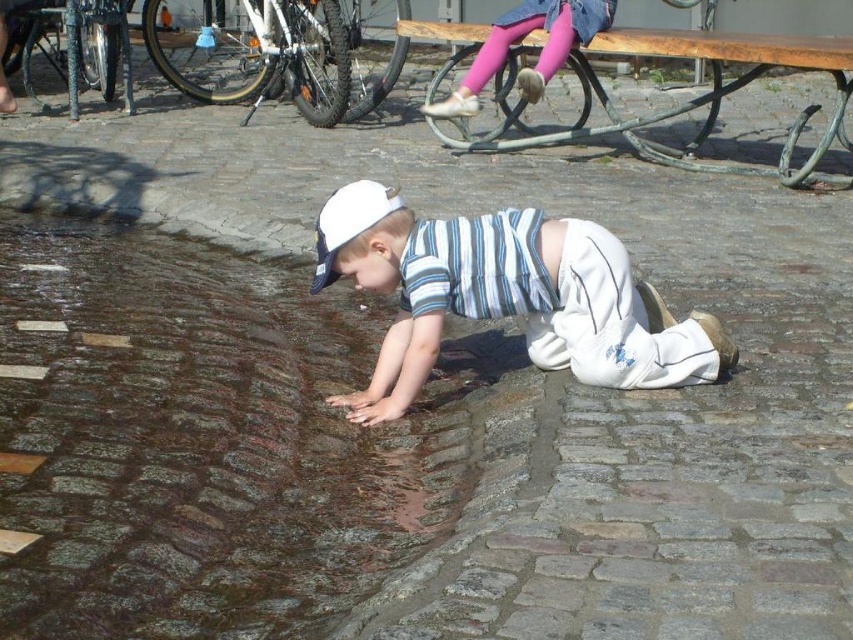
Question: Does wet cobblestone at lower center appear on the right side of pink denim leggings at upper center?

Choices:
 (A) no
 (B) yes

Answer: (A)

Question: Which point appears farthest from the camera in this image?

Choices:
 (A) (135, 387)
 (B) (604, 376)

Answer: (A)

Question: Considering the real-world distances, which object is farthest from the pink denim leggings at upper center?

Choices:
 (A) white striped shirt at center
 (B) wet cobblestone at lower center

Answer: (A)

Question: Can you confirm if wet cobblestone at lower center is bigger than pink denim leggings at upper center?

Choices:
 (A) no
 (B) yes

Answer: (B)

Question: Is wet cobblestone at lower center to the right of pink denim leggings at upper center from the viewer's perspective?

Choices:
 (A) yes
 (B) no

Answer: (B)

Question: Which is nearer to the wet cobblestone at lower center?

Choices:
 (A) white striped shirt at center
 (B) pink denim leggings at upper center

Answer: (A)